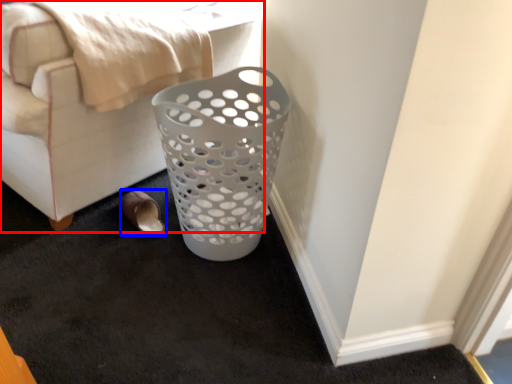
Question: Which point is closer to the camera, furniture (highlighted by a red box) or footwear (highlighted by a blue box)?

Choices:
 (A) furniture
 (B) footwear

Answer: (A)